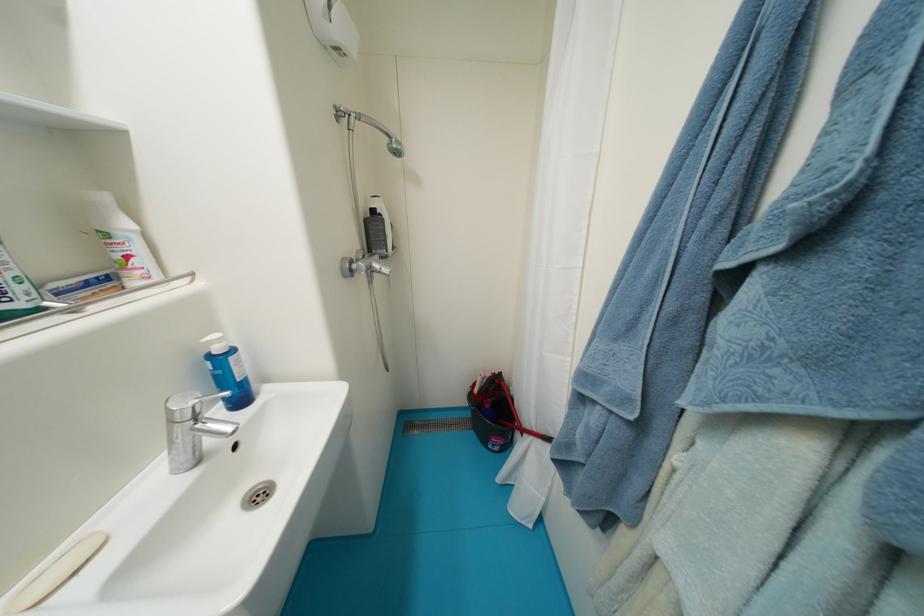
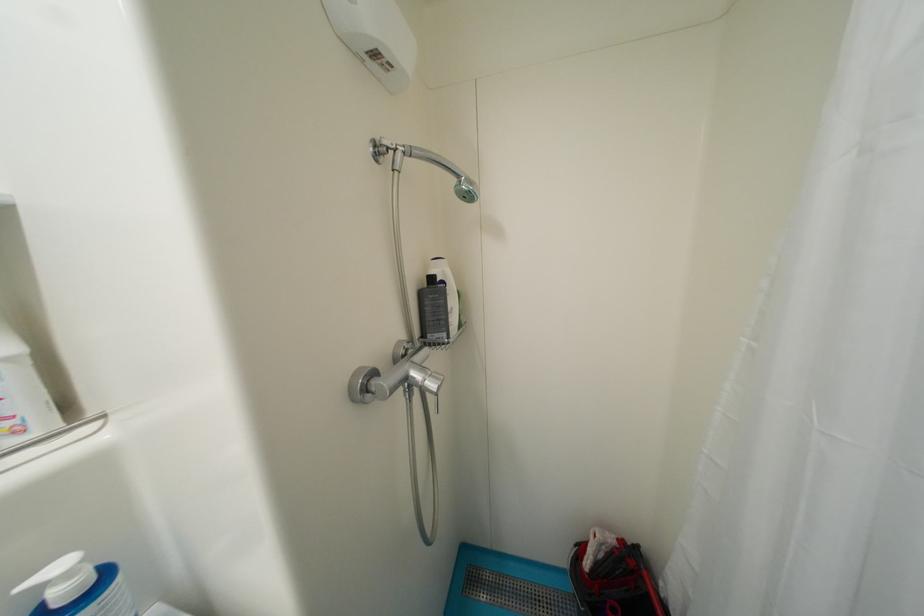
Where in the second image is the point corresponding to (225,342) from the first image?

(75, 576)